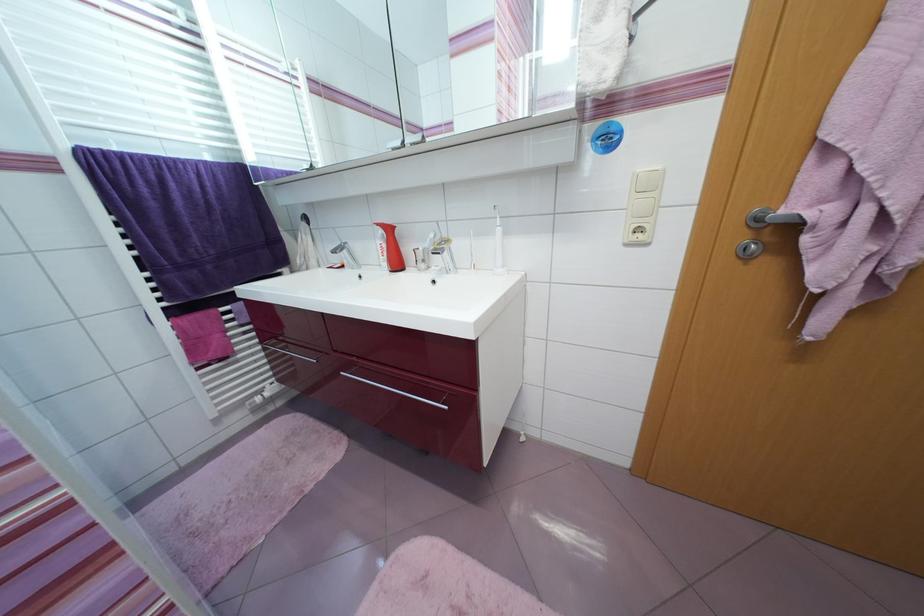
This screenshot has width=924, height=616. I want to click on door keyhole, so click(748, 249).